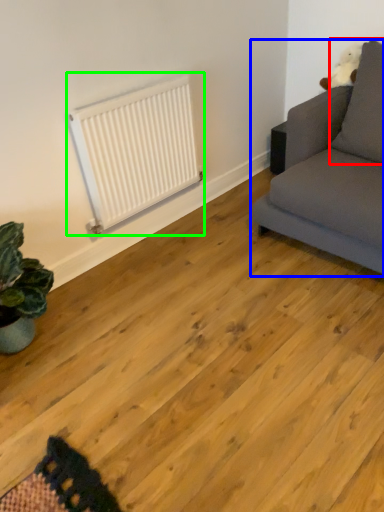
Question: Which is nearer to the pillow (highlighted by a red box)? studio couch (highlighted by a blue box) or radiator (highlighted by a green box).

Choices:
 (A) studio couch
 (B) radiator

Answer: (A)